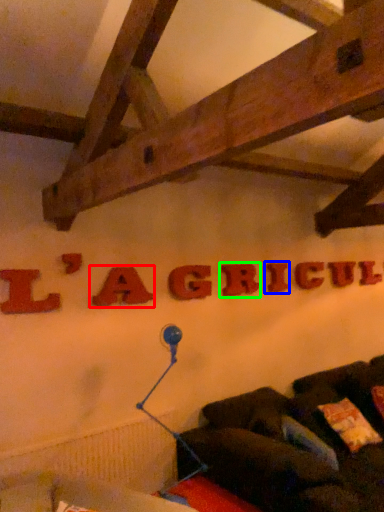
Question: Which is farther away from letter (highlighted by a red box)? letter (highlighted by a blue box) or letter (highlighted by a green box)?

Choices:
 (A) letter
 (B) letter

Answer: (A)